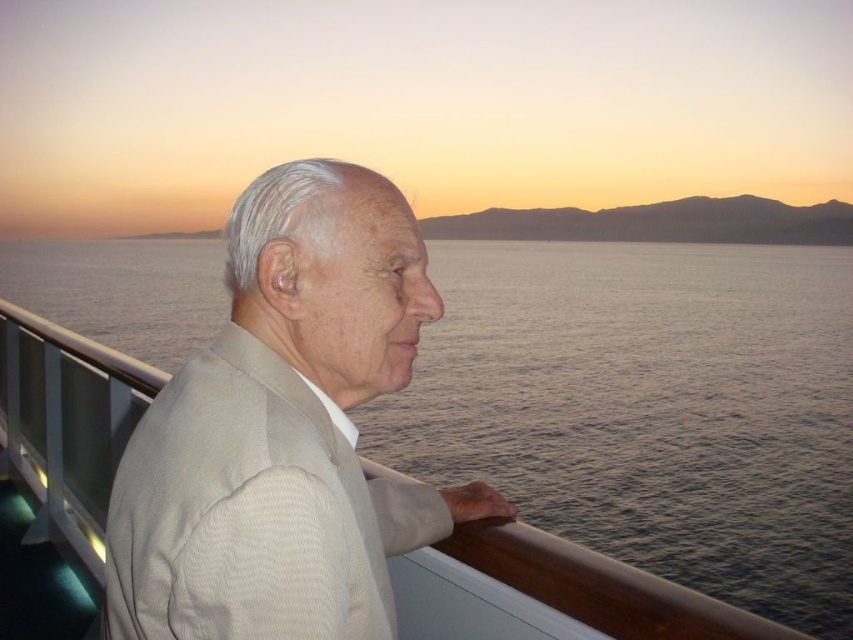
You are standing in front of the deck and want to place a small decoration between the two points labeled point (846, 573) and point (138, 525). Which point is closer to you so that the decoration can be placed appropriately?

Point (138, 525) is closer to you than point (846, 573), so place the decoration near that point to ensure it is accessible.

You are a photographer trying to capture the reflection of the sky in the gray water at left while also including the beige textured suit at center in your shot. Based on their positions, which object should you focus on first to ensure both are in frame?

The gray water at left is to the left of the beige textured suit at center, so you should focus on the gray water at left first to ensure both are in frame.

You are a photographer trying to capture the reflection of the sky in the gray water at left while also including the beige textured suit at center in the frame. Given their sizes, which object should you focus on first to ensure both are visible in the photo?

The gray water at left is bigger than the beige textured suit at center, so you should focus on the gray water at left first to ensure its reflection is clear while still capturing the smaller beige textured suit at center in the frame.